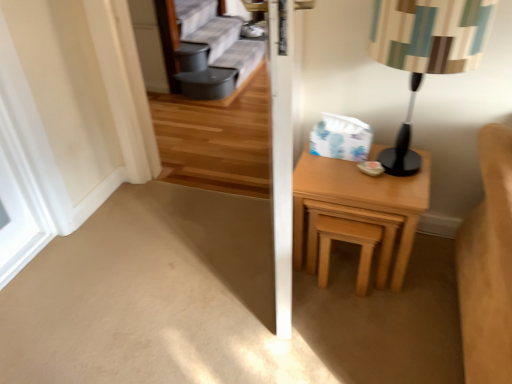
Find the location of a particular element. unoccupied region to the right of light brown wooden stool at right is located at coordinates (412, 283).